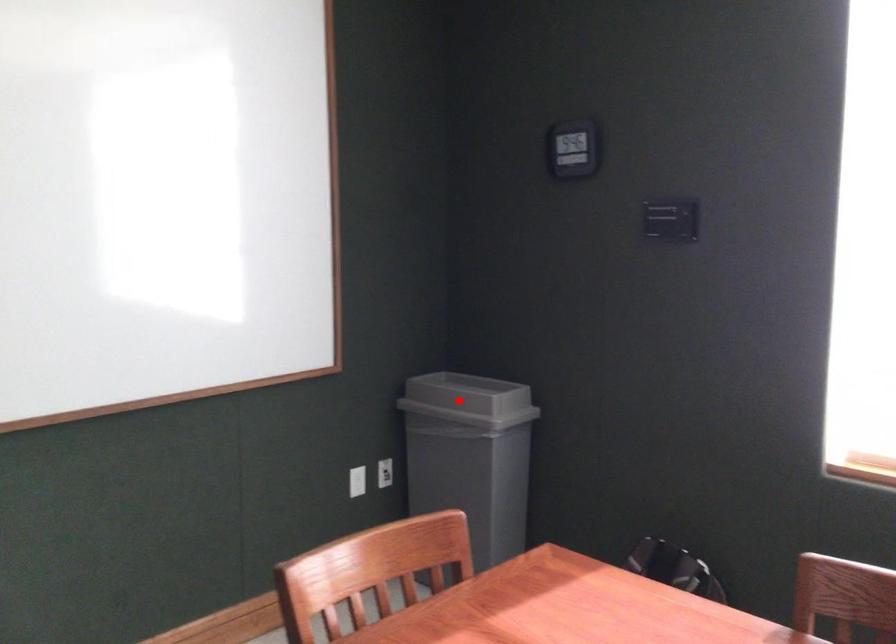
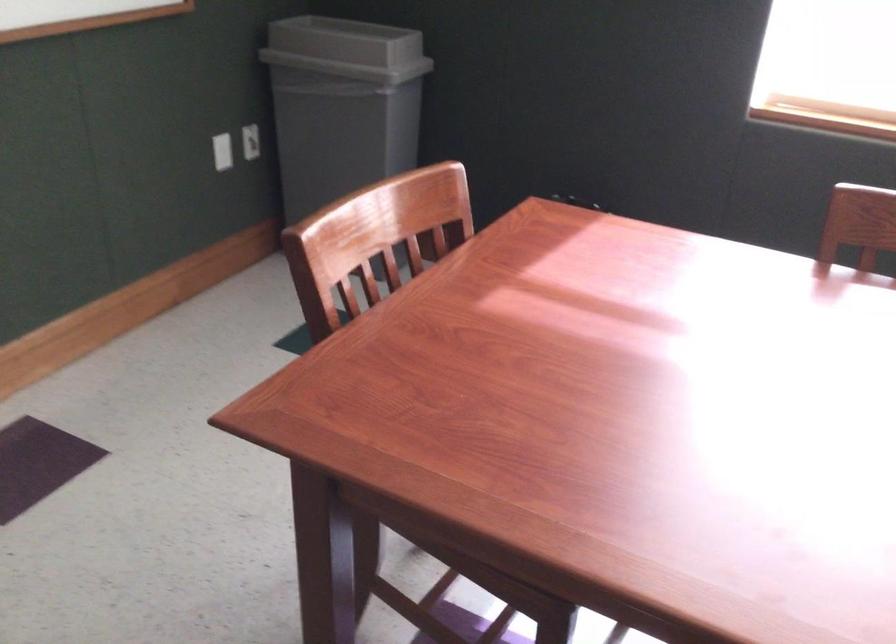
Where in the second image is the point corresponding to the highlighted location from the first image?

(346, 49)